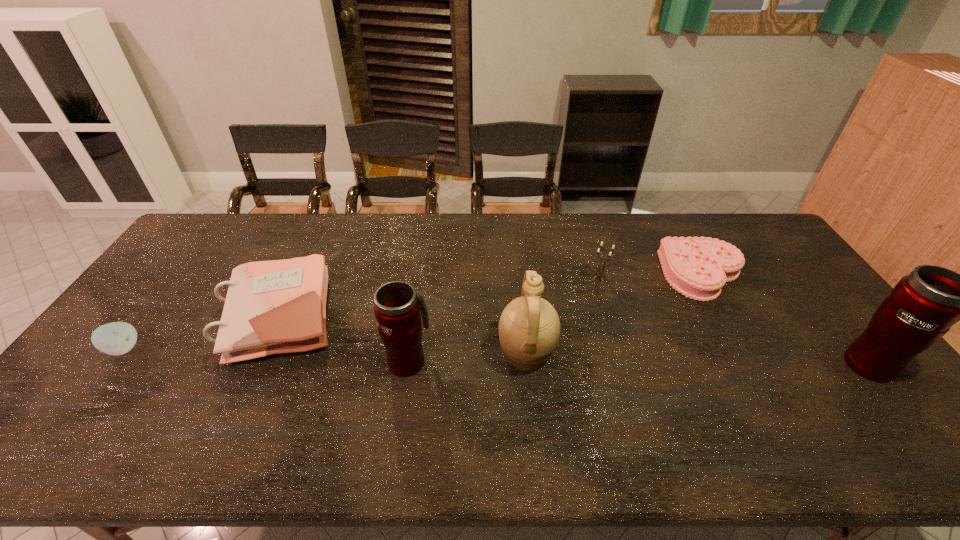
If the aim is uniform spacing by inserting an additional thermos_bottle among them, please point to a vacant space for this new thermos_bottle. Please provide its 2D coordinates. Your answer should be formatted as a tuple, i.e. [(x, y)], where the tuple contains the x and y coordinates of a point satisfying the conditions above.

[(638, 361)]